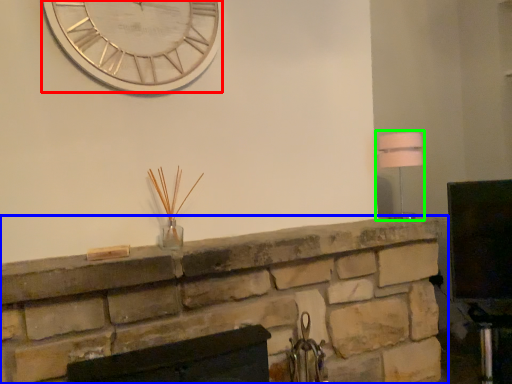
Question: Based on their relative distances, which object is nearer to wall clock (highlighted by a red box)? Choose from fireplace (highlighted by a blue box) and lamp (highlighted by a green box).

Choices:
 (A) fireplace
 (B) lamp

Answer: (A)